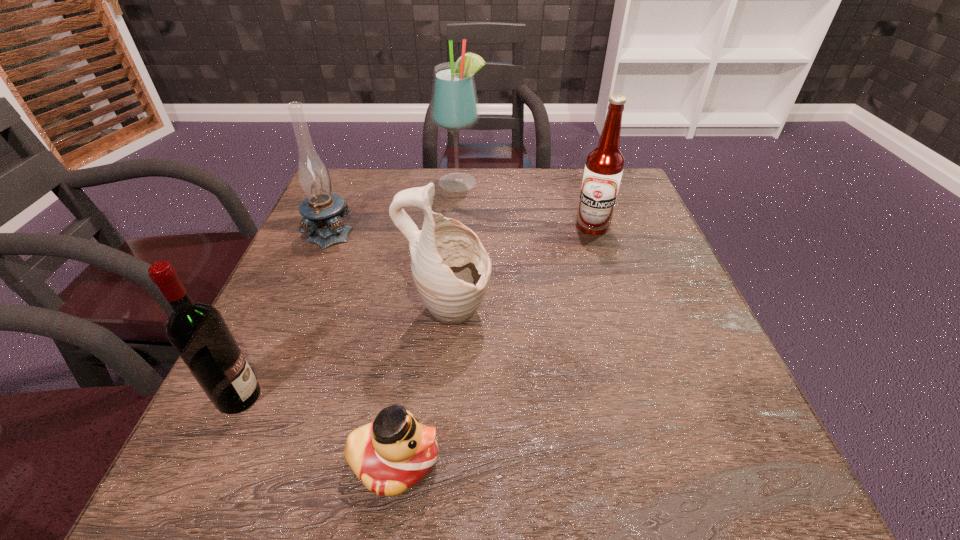
Locate an element on the screen. This screenshot has width=960, height=540. vacant space located on the right of the farthest alcohol is located at coordinates (597, 183).

At what (x,y) coordinates should I click in order to perform the action: click on vacant space located 0.380m on the front of the oil lamp. Please return your answer as a coordinate pair (x, y). The image size is (960, 540). Looking at the image, I should click on (265, 389).

Where is `vacant space located 0.080m on the label side of the rightmost alcohol`? vacant space located 0.080m on the label side of the rightmost alcohol is located at coordinates (602, 257).

Identify the location of vacant space positioned at the spout of the third nearest object. (516, 315).

Where is `vacant space located on the front and back of the nearest alcohol`? The image size is (960, 540). vacant space located on the front and back of the nearest alcohol is located at coordinates (434, 397).

The image size is (960, 540). I want to click on free space located on the face of the nearest object, so click(x=575, y=461).

Find the location of a particular element. object that is at the far edge is located at coordinates (454, 108).

You are a GUI agent. You are given a task and a screenshot of the screen. Output one action in this format:
    pyautogui.click(x=<x>, y=<y>)
    Task: Click on the object that is at the near edge
    
    Given the screenshot: What is the action you would take?
    pyautogui.click(x=394, y=452)

Identify the location of oil lamp located at the left edge. The image size is (960, 540). (320, 209).

This screenshot has width=960, height=540. In order to click on alcohol located at the left edge in this screenshot , I will do `click(198, 332)`.